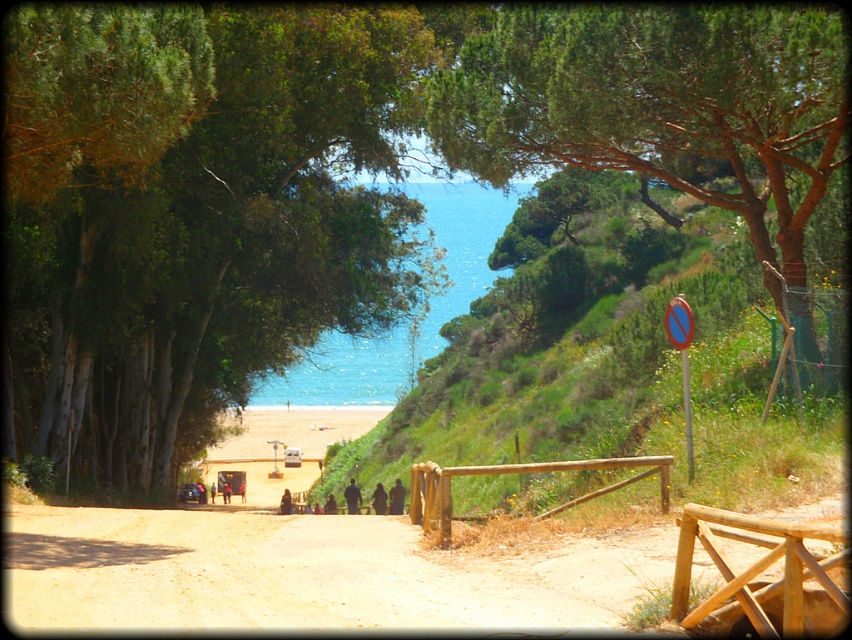
Can you confirm if green leafy tree at center is wider than green grassy hillside at center?

Incorrect, green leafy tree at center's width does not surpass green grassy hillside at center's.

Is green leafy tree at center taller than green grassy hillside at center?

Incorrect, green leafy tree at center's height is not larger of green grassy hillside at center's.

You are a GUI agent. You are given a task and a screenshot of the screen. Output one action in this format:
    pyautogui.click(x=<x>, y=<y>)
    Task: Click on the green leafy tree at center
    
    Given the screenshot: What is the action you would take?
    pyautogui.click(x=193, y=214)

Does green grassy hillside at center have a lesser height compared to green leafy tree at upper right?

No.

Where is `green grassy hillside at center`? The height and width of the screenshot is (640, 852). green grassy hillside at center is located at coordinates (603, 348).

At what (x,y) coordinates should I click in order to perform the action: click on green grassy hillside at center. Please return your answer as a coordinate pair (x, y). The width and height of the screenshot is (852, 640). Looking at the image, I should click on (603, 348).

Between green leafy tree at upper right and blue water at center, which one has more height?

Standing taller between the two is blue water at center.

What do you see at coordinates (661, 106) in the screenshot? The width and height of the screenshot is (852, 640). I see `green leafy tree at upper right` at bounding box center [661, 106].

You are a GUI agent. You are given a task and a screenshot of the screen. Output one action in this format:
    pyautogui.click(x=<x>, y=<y>)
    Task: Click on the green leafy tree at upper right
    
    Given the screenshot: What is the action you would take?
    pyautogui.click(x=661, y=106)